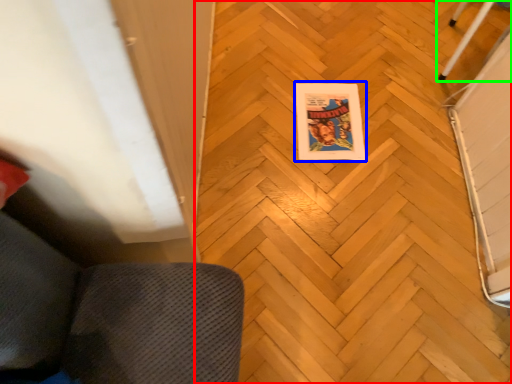
Question: Estimate the real-world distances between objects in this image. Which object is closer to plywood (highlighted by a red box), comic book (highlighted by a blue box) or furniture (highlighted by a green box)?

Choices:
 (A) comic book
 (B) furniture

Answer: (A)